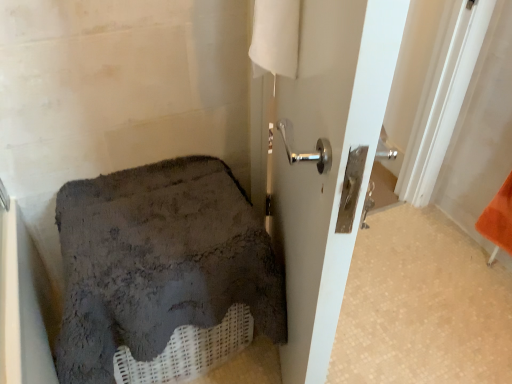
The image size is (512, 384). What are the coordinates of `gray matte towel at lower left` in the screenshot? It's located at (158, 263).

What do you see at coordinates (158, 263) in the screenshot? The height and width of the screenshot is (384, 512). I see `gray matte towel at lower left` at bounding box center [158, 263].

Locate an element on the screen. gray matte towel at lower left is located at coordinates (x=158, y=263).